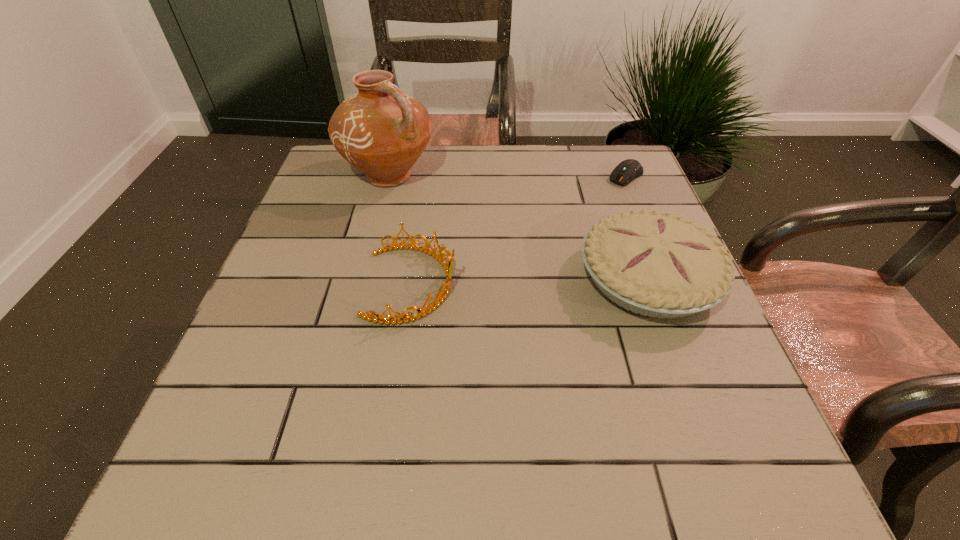
Where is `vacant space at the left edge`? The height and width of the screenshot is (540, 960). vacant space at the left edge is located at coordinates (292, 277).

At what (x,y) coordinates should I click in order to perform the action: click on vacant space at the right edge of the desktop. Please return your answer as a coordinate pair (x, y). The height and width of the screenshot is (540, 960). Looking at the image, I should click on (619, 206).

In the image, there is a desktop. Where is `vacant space at the near left corner`? The width and height of the screenshot is (960, 540). vacant space at the near left corner is located at coordinates (234, 393).

Image resolution: width=960 pixels, height=540 pixels. I want to click on vacant space at the far right corner of the desktop, so click(597, 146).

Locate an element on the screen. This screenshot has height=540, width=960. empty location between the tiara and the shortest object is located at coordinates (518, 230).

Locate an element on the screen. This screenshot has width=960, height=540. free space between the tallest object and the tiara is located at coordinates (400, 230).

I want to click on free point between the pie and the tiara, so click(x=529, y=281).

Where is `free space between the pie and the pottery`? The width and height of the screenshot is (960, 540). free space between the pie and the pottery is located at coordinates (518, 227).

Locate an element on the screen. free space between the tiara and the pottery is located at coordinates (400, 230).

You are a GUI agent. You are given a task and a screenshot of the screen. Output one action in this format:
    pyautogui.click(x=<x>, y=<y>)
    Task: Click on the vacant region between the pie and the tallest object
    This screenshot has width=960, height=540.
    Given the screenshot: What is the action you would take?
    pyautogui.click(x=518, y=227)